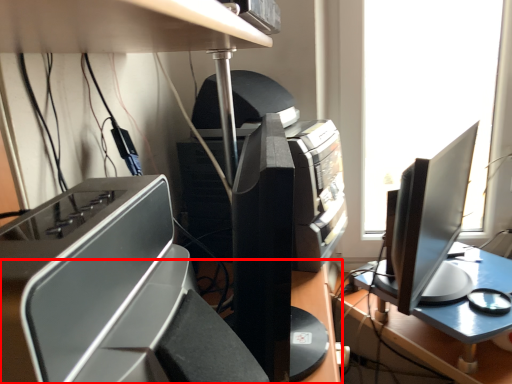
Question: From the image's perspective, what is the correct spatial positioning of desk (annotated by the red box) in reference to printer?

Choices:
 (A) above
 (B) below

Answer: (B)